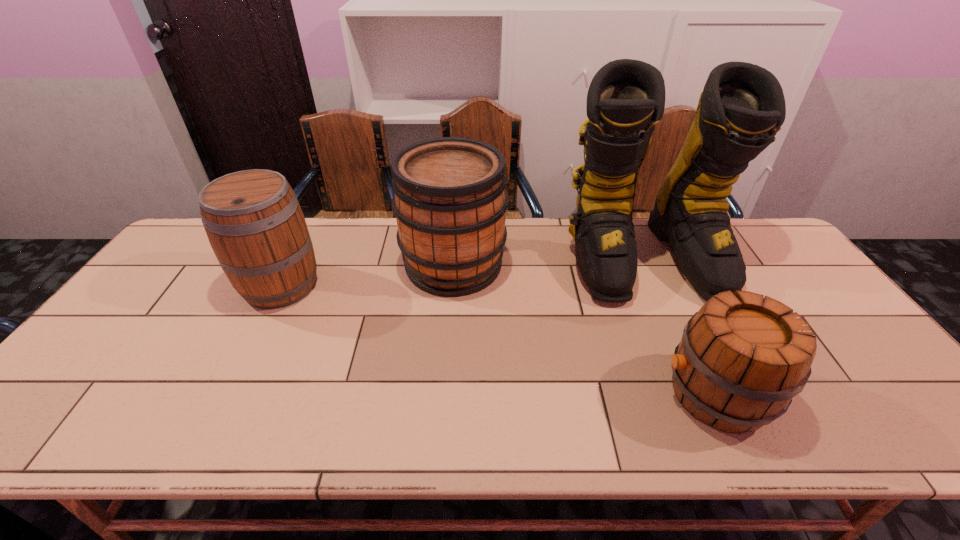
You are a GUI agent. You are given a task and a screenshot of the screen. Output one action in this format:
    pyautogui.click(x=<x>, y=<y>)
    Task: Click on the vacant space located 0.240m on the side of the rightmost cider where the spigot is located
    The image size is (960, 540).
    Given the screenshot: What is the action you would take?
    pyautogui.click(x=556, y=394)

You are a GUI agent. You are given a task and a screenshot of the screen. Output one action in this format:
    pyautogui.click(x=<x>, y=<y>)
    Task: Click on the ski boots located at the far edge
    
    Given the screenshot: What is the action you would take?
    pyautogui.click(x=742, y=107)

What are the coordinates of `object that is at the near edge` in the screenshot? It's located at (741, 360).

The height and width of the screenshot is (540, 960). I want to click on free location at the far edge of the desktop, so click(365, 244).

Locate an element on the screen. vacant space at the left edge of the desktop is located at coordinates (166, 334).

I want to click on vacant space at the right edge of the desktop, so click(x=820, y=330).

In the image, there is a desktop. At what (x,y) coordinates should I click in order to perform the action: click on vacant space at the near left corner. Please return your answer as a coordinate pair (x, y). Looking at the image, I should click on pos(99,420).

Where is `vacant space in between the second cider from right to left and the tallest object`? The image size is (960, 540). vacant space in between the second cider from right to left and the tallest object is located at coordinates (549, 261).

Find the location of a particular element. The width and height of the screenshot is (960, 540). vacant point located between the rightmost cider and the ski boots is located at coordinates (680, 326).

Where is `vacant area that lies between the tallest object and the nearest cider`? Image resolution: width=960 pixels, height=540 pixels. vacant area that lies between the tallest object and the nearest cider is located at coordinates (680, 326).